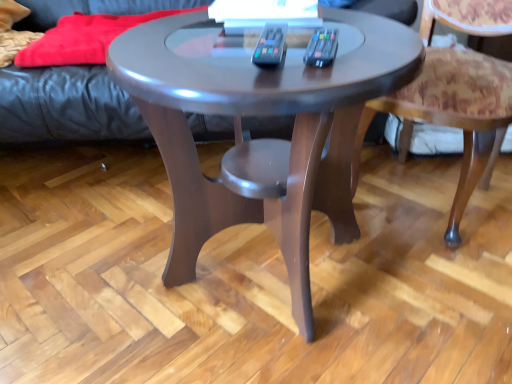
Locate an element on the screen. The height and width of the screenshot is (384, 512). leather couch at upper left is located at coordinates (65, 106).

What do you see at coordinates (65, 106) in the screenshot? I see `leather couch at upper left` at bounding box center [65, 106].

Locate an element on the screen. glossy wood coffee table at center is located at coordinates (261, 115).

The image size is (512, 384). I want to click on leather couch at upper left, so click(x=65, y=106).

Does leather couch at upper left turn towards patterned fabric chair at lower right?

Yes, leather couch at upper left is aimed at patterned fabric chair at lower right.

Considering the relative positions of leather couch at upper left and patterned fabric chair at lower right in the image provided, is leather couch at upper left to the left or to the right of patterned fabric chair at lower right?

In the image, leather couch at upper left appears on the left side of patterned fabric chair at lower right.

Which object is further away from the camera, leather couch at upper left or patterned fabric chair at lower right?

leather couch at upper left is further away from the camera.

Is leather couch at upper left in contact with patterned fabric chair at lower right?

No, leather couch at upper left is not making contact with patterned fabric chair at lower right.

Which of these two, leather couch at upper left or glossy wood coffee table at center, is smaller?

glossy wood coffee table at center.

The width and height of the screenshot is (512, 384). What are the coordinates of `coffee table to the right of leather couch at upper left` in the screenshot? It's located at (261, 115).

Is leather couch at upper left far away from glossy wood coffee table at center?

They are positioned close to each other.

Is leather couch at upper left inside the boundaries of glossy wood coffee table at center, or outside?

leather couch at upper left is outside glossy wood coffee table at center.

Is point (477, 113) farther from viewer compared to point (268, 86)?

Yes, point (477, 113) is behind point (268, 86).

What's the angular difference between patterned fabric chair at lower right and glossy wood coffee table at center's facing directions?

The facing directions of patterned fabric chair at lower right and glossy wood coffee table at center are 40.1 degrees apart.

Does patterned fabric chair at lower right have a lesser height compared to glossy wood coffee table at center?

Incorrect, the height of patterned fabric chair at lower right does not fall short of that of glossy wood coffee table at center.

Do you think patterned fabric chair at lower right is within glossy wood coffee table at center, or outside of it?

patterned fabric chair at lower right lies outside glossy wood coffee table at center.

Is glossy wood coffee table at center spatially inside patterned fabric chair at lower right, or outside of it?

The correct answer is: outside.

From the picture: Which is nearer, (x=198, y=245) or (x=460, y=23)?

The point (x=198, y=245) is closer.

From the image's perspective, between glossy wood coffee table at center and patterned fabric chair at lower right, who is located below?

glossy wood coffee table at center, from the image's perspective.

How different are the orientations of glossy wood coffee table at center and patterned fabric chair at lower right in degrees?

The angular difference between glossy wood coffee table at center and patterned fabric chair at lower right is 40.1 degrees.

Is glossy wood coffee table at center inside the boundaries of leather couch at upper left, or outside?

glossy wood coffee table at center cannot be found inside leather couch at upper left.

Which is behind, point (306, 97) or point (74, 6)?

The point (74, 6) is farther from the camera.

Image resolution: width=512 pixels, height=384 pixels. In order to click on coffee table in front of the leather couch at upper left in this screenshot , I will do `click(261, 115)`.

The image size is (512, 384). Identify the location of chair in front of the leather couch at upper left. (454, 115).

How different are the orientations of patterned fabric chair at lower right and leather couch at upper left in degrees?

The angular difference between patterned fabric chair at lower right and leather couch at upper left is 36.8 degrees.

Measure the distance between patterned fabric chair at lower right and leather couch at upper left.

patterned fabric chair at lower right is 58.21 centimeters from leather couch at upper left.

Would you say patterned fabric chair at lower right is outside leather couch at upper left?

Yes, patterned fabric chair at lower right is not within leather couch at upper left.

Locate an element on the screen. couch on the left of the patterned fabric chair at lower right is located at coordinates (65, 106).

In the image, there is a leather couch at upper left. Where is `coffee table below it (from a real-world perspective)`? Image resolution: width=512 pixels, height=384 pixels. coffee table below it (from a real-world perspective) is located at coordinates (261, 115).

Based on their spatial positions, is patterned fabric chair at lower right or glossy wood coffee table at center closer to leather couch at upper left?

glossy wood coffee table at center is positioned closer to the anchor leather couch at upper left.

Looking at the image, which one is located further to glossy wood coffee table at center, patterned fabric chair at lower right or leather couch at upper left?

The object further to glossy wood coffee table at center is leather couch at upper left.

Estimate the real-world distances between objects in this image. Which object is closer to patterned fabric chair at lower right, leather couch at upper left or glossy wood coffee table at center?

glossy wood coffee table at center is positioned closer to the anchor patterned fabric chair at lower right.

Which object lies nearer to the anchor point leather couch at upper left, glossy wood coffee table at center or patterned fabric chair at lower right?

glossy wood coffee table at center lies closer to leather couch at upper left than the other object.

Which object lies further to the anchor point patterned fabric chair at lower right, glossy wood coffee table at center or leather couch at upper left?

leather couch at upper left lies further to patterned fabric chair at lower right than the other object.

Estimate the real-world distances between objects in this image. Which object is further from glossy wood coffee table at center, leather couch at upper left or patterned fabric chair at lower right?

Among the two, leather couch at upper left is located further to glossy wood coffee table at center.

Locate an element on the screen. The height and width of the screenshot is (384, 512). coffee table between leather couch at upper left and patterned fabric chair at lower right is located at coordinates (261, 115).